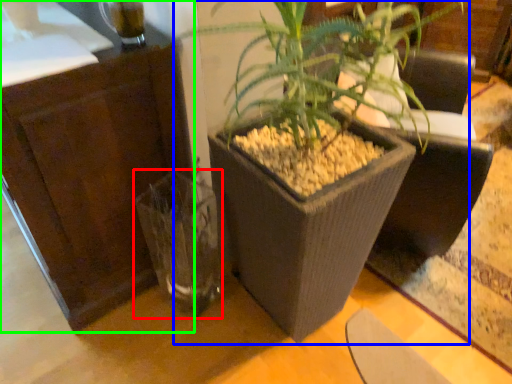
Question: Which object is the farthest from vase (highlighted by a red box)? Choose among these: houseplant (highlighted by a blue box) or dresser (highlighted by a green box).

Choices:
 (A) houseplant
 (B) dresser

Answer: (A)